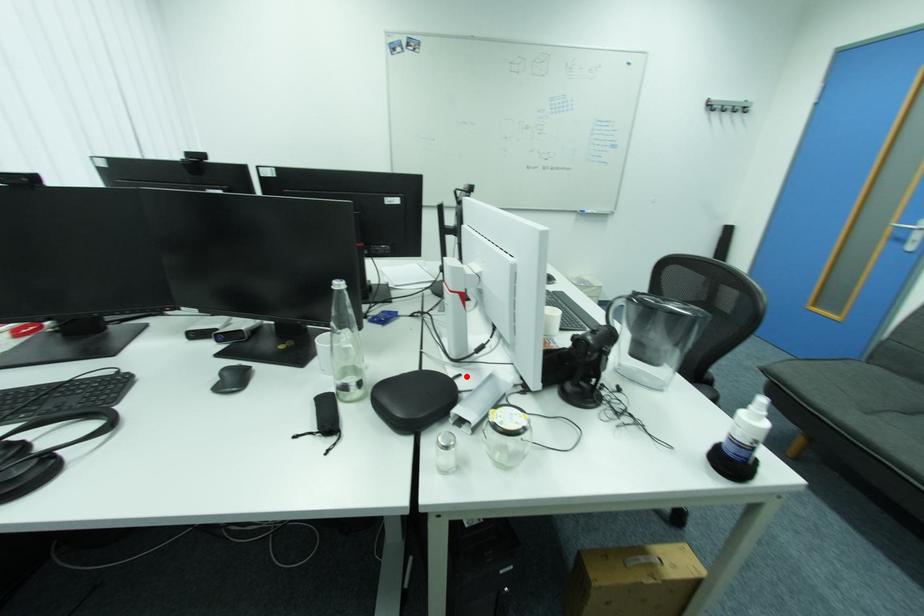
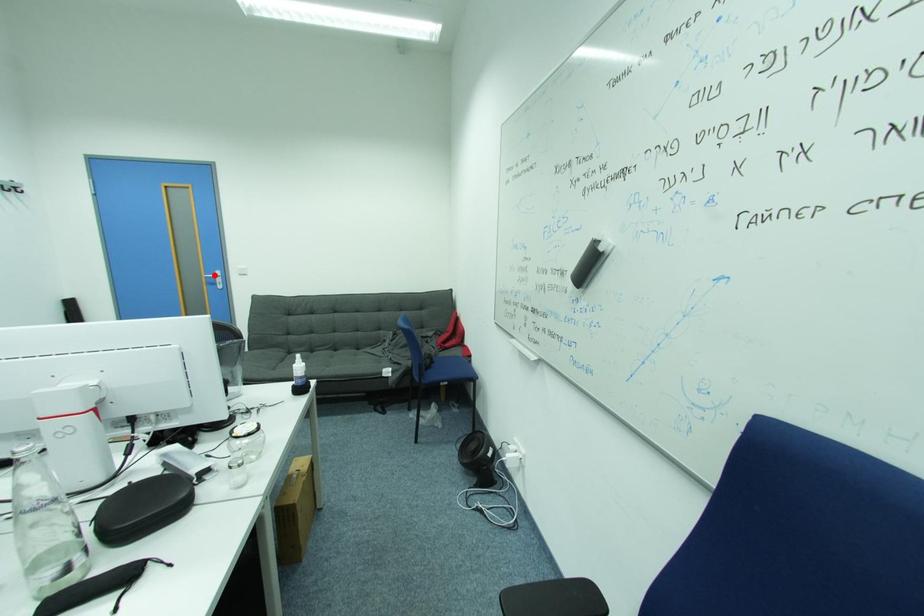
I am providing you with two images of the same scene from different viewpoints. A red point is marked on the first image and another point is marked on the second image. Is the marked point in image1 the same physical position as the marked point in image2?

No